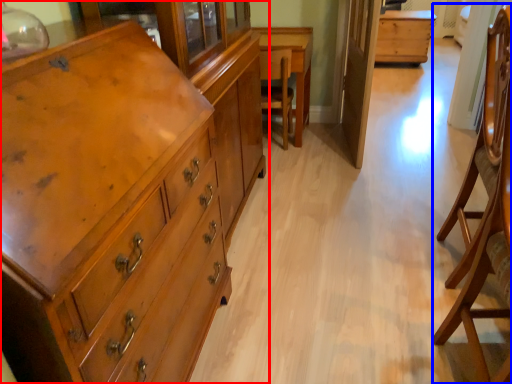
Question: Which object is further to the camera taking this photo, chest of drawers (highlighted by a red box) or armchair (highlighted by a blue box)?

Choices:
 (A) chest of drawers
 (B) armchair

Answer: (B)